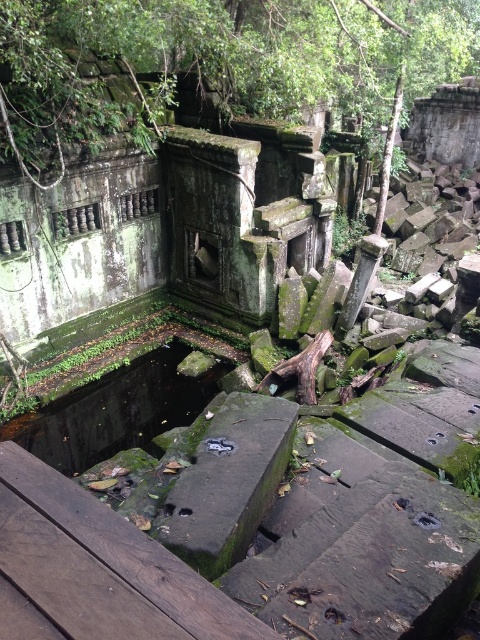
You are an archaeologist standing at the edge of the rectangular pool in the ancient stone structure. You need to place a 4.5 meter long wooden ladder from the brown wooden plank at lower left to the green mossy stone at center. Will the ladder be long enough to bridge the gap between them?

The distance between the brown wooden plank at lower left and the green mossy stone at center is 5.09 meters. Since the ladder is only 4.5 meters long, it will not be long enough to bridge the gap between them.

You are an archaeologist standing at the brown wooden plank at lower left, and you need to reach the green mossy stone at upper center to examine its carvings. Given that your equipment can only carry items up to 25 feet away, can you safely transport your tools directly to the stone without needing to move them further?

The distance between the green mossy stone at upper center and the brown wooden plank at lower left is 24.56 feet, which is just under the 25 feet limit of your equipment. Therefore, you can safely transport your tools directly to the stone without needing to move them further.

You are an archaeologist examining the ancient stone structure. You notice the brown wooden plank at lower left and the green mossy stone at upper center. Which object is closer to you from your current viewpoint?

The green mossy stone at upper center is closer to you because the brown wooden plank at lower left is behind it.